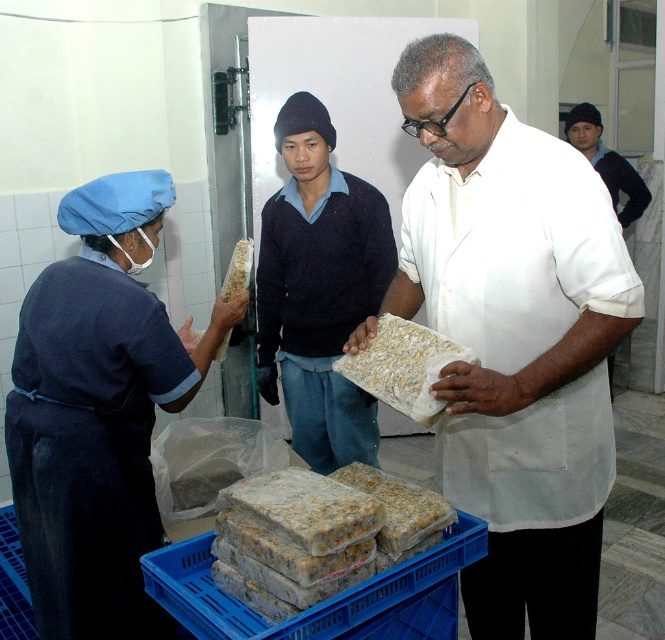
Is blue fabric uniform at left shorter than black knit cap at upper right?

No.

Is blue fabric uniform at left bigger than black knit cap at upper right?

Correct, blue fabric uniform at left is larger in size than black knit cap at upper right.

Measure the distance between point (156,180) and camera.

They are 1.75 meters apart.

Find the location of `blue fabric uniform at left`. blue fabric uniform at left is located at coordinates (98, 412).

Between white textured block at center and black knit cap at upper right, which one appears on the right side from the viewer's perspective?

Positioned to the right is black knit cap at upper right.

Between point (416, 376) and point (575, 104), which one is positioned in front?

Positioned in front is point (416, 376).

Does point (380, 321) lie behind point (598, 125)?

No, it is in front of (598, 125).

This screenshot has height=640, width=665. I want to click on white textured block at center, so click(x=404, y=365).

Is white matte rectangular object at center below black knit cap at upper right?

Yes, white matte rectangular object at center is below black knit cap at upper right.

Is point (541, 438) less distant than point (604, 168)?

Yes, point (541, 438) is closer to viewer.

Who is more distant from viewer, (515,582) or (602,173)?

Positioned behind is point (602,173).

Where is `white matte rectangular object at center`? The image size is (665, 640). white matte rectangular object at center is located at coordinates (513, 337).